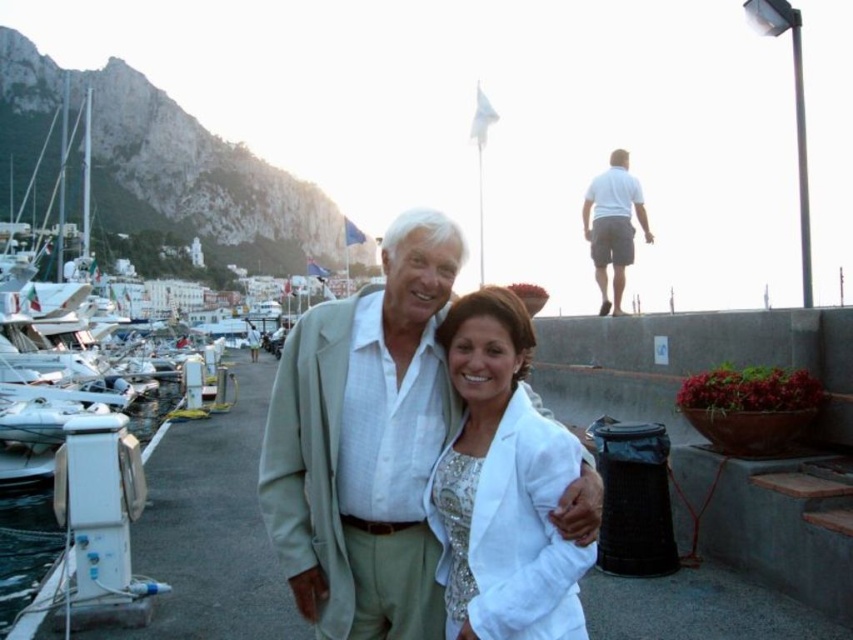
Which of these two, light green fabric suit at center or white cotton shirt at upper right, stands shorter?

light green fabric suit at center

Which is more to the left, light green fabric suit at center or white cotton shirt at upper right?

light green fabric suit at center

This screenshot has width=853, height=640. I want to click on light green fabric suit at center, so click(x=364, y=442).

Which is in front, point (395, 406) or point (491, 552)?

Point (491, 552) is more forward.

Can you confirm if light green fabric suit at center is positioned to the right of white satin blazer at center?

Incorrect, light green fabric suit at center is not on the right side of white satin blazer at center.

Between point (306, 525) and point (444, 456), which one is positioned behind?

Positioned behind is point (444, 456).

At what (x,y) coordinates should I click in order to perform the action: click on light green fabric suit at center. Please return your answer as a coordinate pair (x, y). Image resolution: width=853 pixels, height=640 pixels. Looking at the image, I should click on (364, 442).

Which is more to the left, white satin blazer at center or white cotton shirt at upper right?

Positioned to the left is white satin blazer at center.

Is white satin blazer at center closer to the viewer compared to white cotton shirt at upper right?

That is True.

Is point (461, 364) behind point (628, 244)?

No, (461, 364) is in front of (628, 244).

The width and height of the screenshot is (853, 640). I want to click on white satin blazer at center, so click(502, 486).